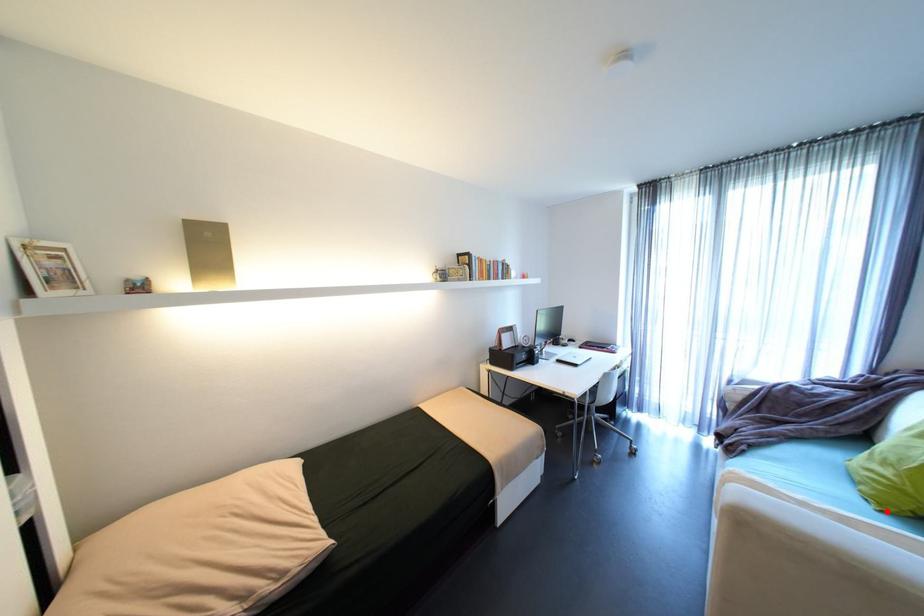
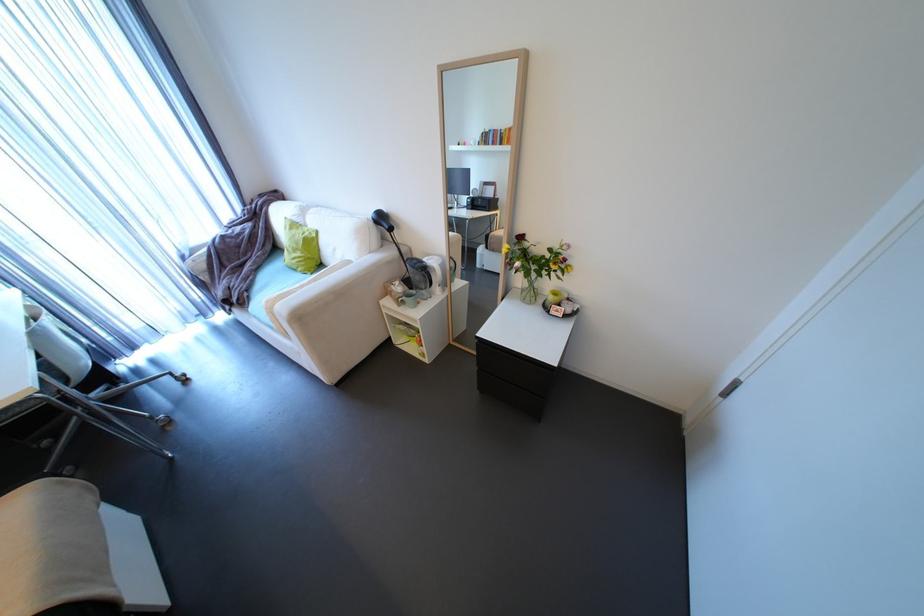
Where in the second image is the point corresponding to the highlighted location from the first image?

(319, 274)